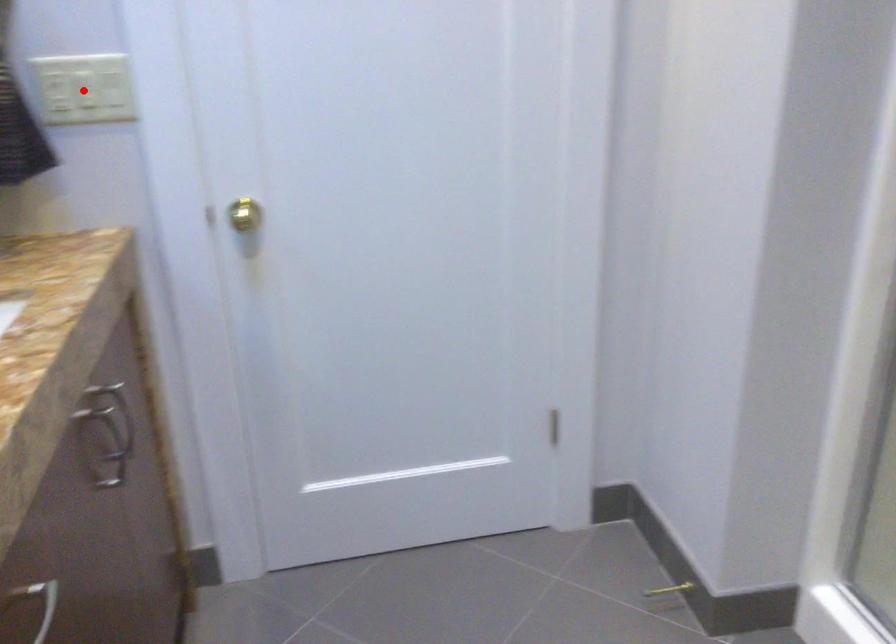
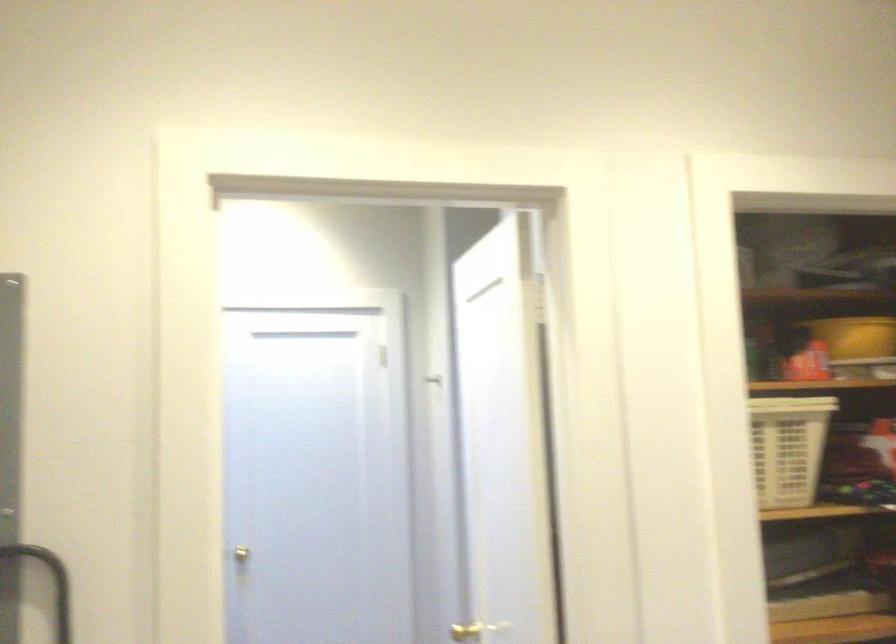
Question: I am providing you with two images of the same scene from different viewpoints. A red point is marked on the first image. Can you still see the location of the red point in image 2?

Choices:
 (A) Yes
 (B) No

Answer: (B)